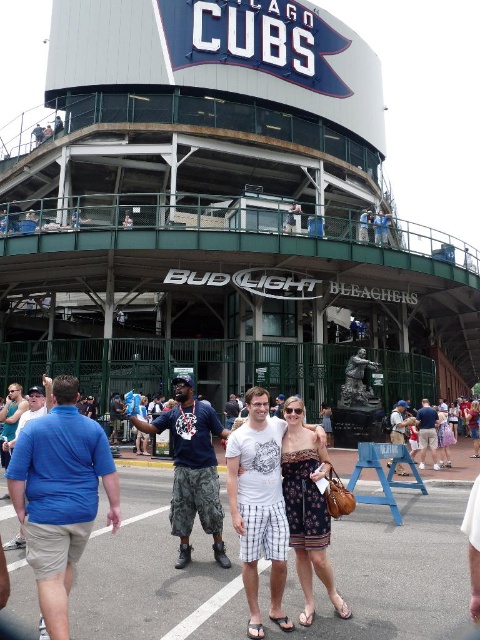
Question: Can you confirm if patterned fabric dress at center is positioned below matte brown statue at center?

Choices:
 (A) yes
 (B) no

Answer: (B)

Question: Among these points, which one is nearest to the camera?

Choices:
 (A) (428, 449)
 (B) (314, 428)

Answer: (B)

Question: Which object is closer to the camera taking this photo?

Choices:
 (A) patterned fabric dress at center
 (B) matte brown statue at center

Answer: (A)

Question: Is patterned fabric dress at center behind matte brown statue at center?

Choices:
 (A) no
 (B) yes

Answer: (A)

Question: Can you confirm if patterned fabric dress at center is positioned below matte brown statue at center?

Choices:
 (A) no
 (B) yes

Answer: (A)

Question: Which of the following is the closest to the observer?

Choices:
 (A) patterned fabric dress at center
 (B) matte brown statue at center

Answer: (A)